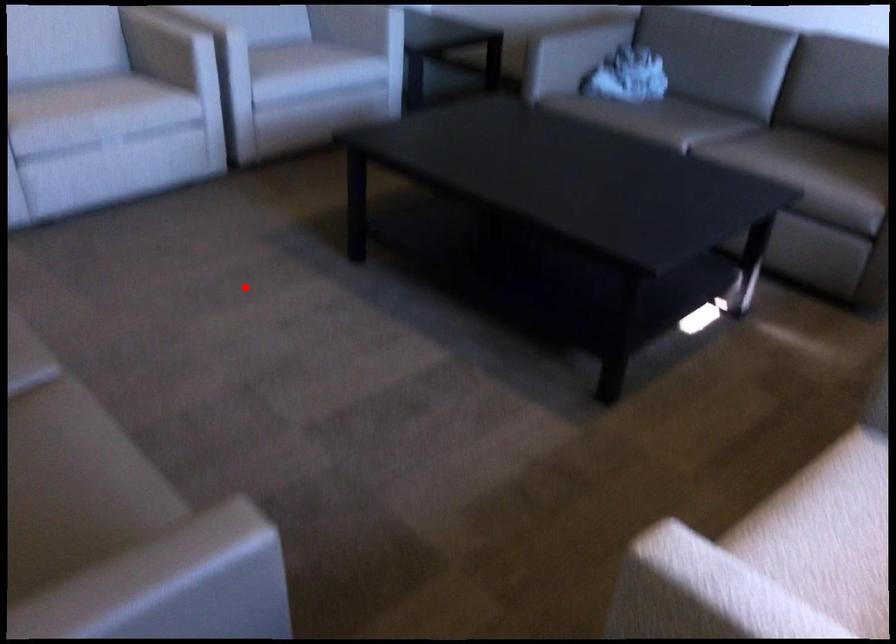
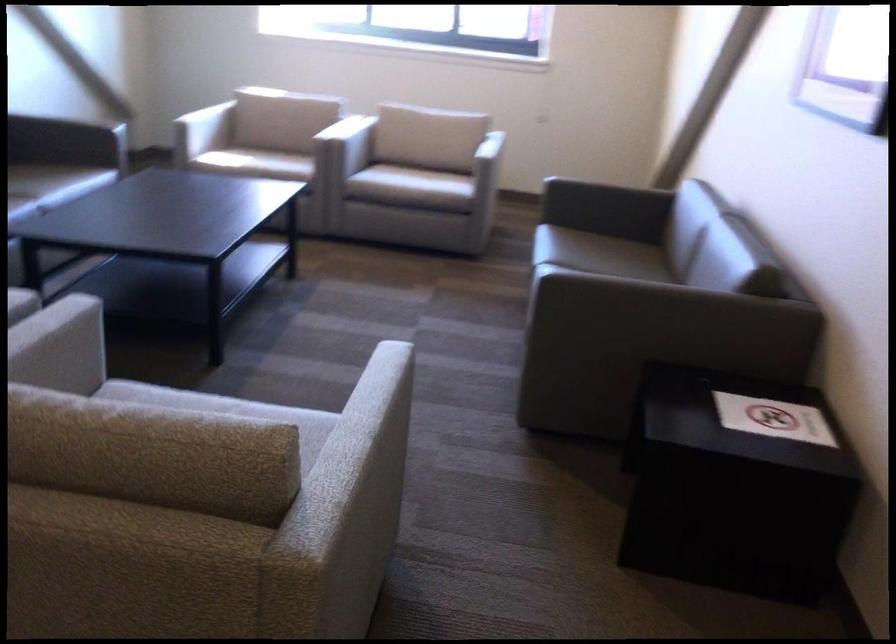
Find the pixel in the second image that matches the highlighted location in the first image.

(279, 406)